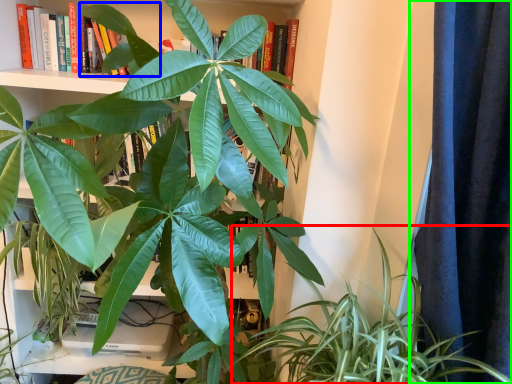
Question: Estimate the real-world distances between objects in this image. Which object is farther from houseplant (highlighted by a red box), leaf (highlighted by a blue box) or curtain (highlighted by a green box)?

Choices:
 (A) leaf
 (B) curtain

Answer: (A)